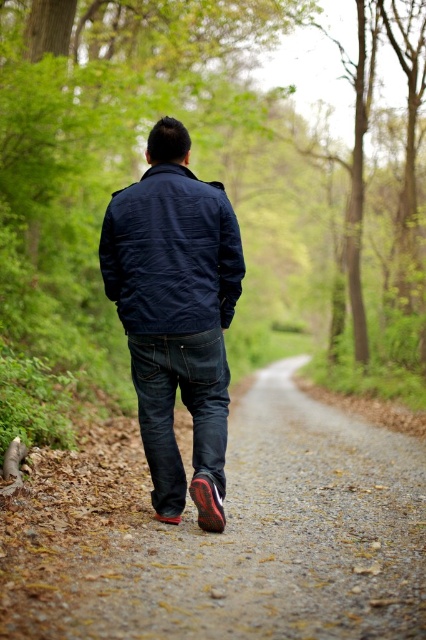
In the scene where a person is walking down a gravel path surrounded by greenery, you notice the navy blue jacket at center and dark blue denim jeans at center. Which piece of clothing is positioned to the left of the other?

The navy blue jacket at center is to the left of the dark blue denim jeans at center.